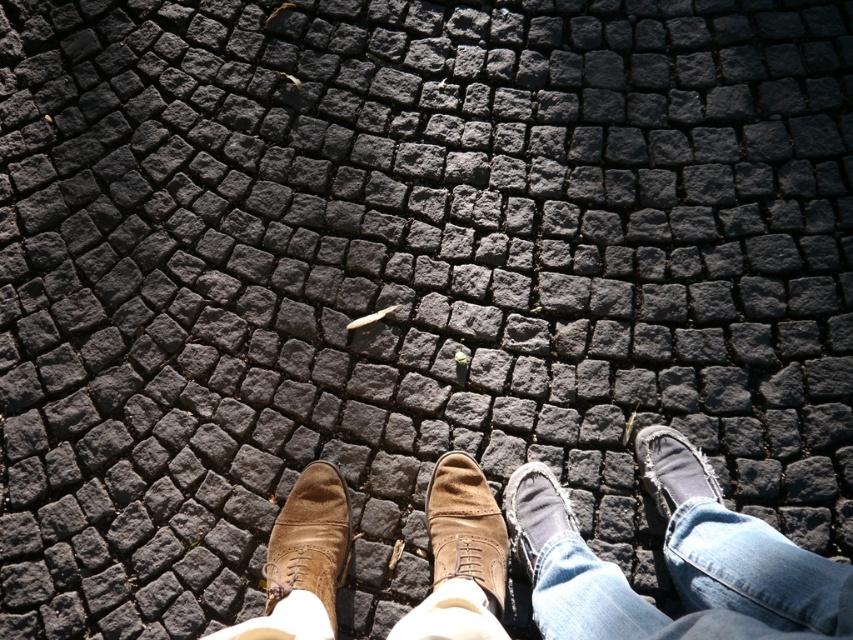
You are walking on a cobblestone path and notice two pairs of shoes ahead. The scene includes brown suede shoes at center and jeans at center. Which pair is positioned to the left?

The brown suede shoes at center are positioned to the left of the jeans at center.

In the scene shown: You are a shoemaker examining two shoes in the image. The brown suede shoe at center and the worn leather shoe at lower right. Which shoe has a wider base?

The brown suede shoe at center has a wider base than the worn leather shoe at lower right.